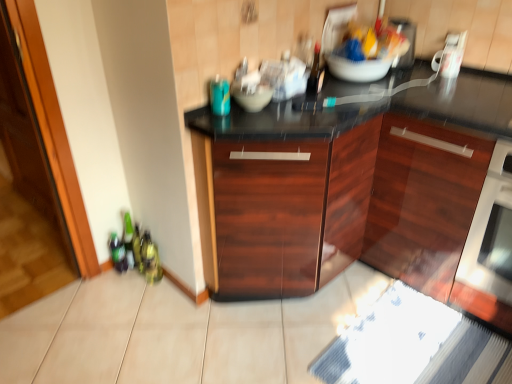
Question: Is satin white oven at right inside mahogany wood cabinet at center, the second cabinetry when ordered from right to left?

Choices:
 (A) no
 (B) yes

Answer: (A)

Question: Can you confirm if mahogany wood cabinet at center, the second cabinetry when ordered from right to left, is bigger than satin white oven at right?

Choices:
 (A) no
 (B) yes

Answer: (B)

Question: Does mahogany wood cabinet at center, the 1th cabinetry positioned from the left, have a lesser height compared to satin white oven at right?

Choices:
 (A) yes
 (B) no

Answer: (B)

Question: Is the position of mahogany wood cabinet at center, the second cabinetry when ordered from right to left, less distant than that of satin white oven at right?

Choices:
 (A) no
 (B) yes

Answer: (A)

Question: Does mahogany wood cabinet at center, the 1th cabinetry positioned from the left, come behind satin white oven at right?

Choices:
 (A) yes
 (B) no

Answer: (A)

Question: In terms of height, does dark wood cabinet at center, placed as the first cabinetry when sorted from right to left, look taller or shorter compared to transparent glass door at left?

Choices:
 (A) tall
 (B) short

Answer: (B)

Question: Looking at their shapes, would you say dark wood cabinet at center, acting as the 2th cabinetry starting from the left, is wider or thinner than transparent glass door at left?

Choices:
 (A) wide
 (B) thin

Answer: (A)

Question: Based on their sizes in the image, would you say dark wood cabinet at center, acting as the 2th cabinetry starting from the left, is bigger or smaller than transparent glass door at left?

Choices:
 (A) small
 (B) big

Answer: (B)

Question: Is point (415, 150) closer or farther from the camera than point (0, 193)?

Choices:
 (A) farther
 (B) closer

Answer: (B)

Question: In the image, is teal glass bottle at upper center positioned in front of or behind matte gray bowl at center?

Choices:
 (A) behind
 (B) front

Answer: (B)

Question: From the image's perspective, is teal glass bottle at upper center positioned above or below matte gray bowl at center?

Choices:
 (A) above
 (B) below

Answer: (B)

Question: Does point (214, 89) appear closer or farther from the camera than point (256, 99)?

Choices:
 (A) closer
 (B) farther

Answer: (A)

Question: Choose the correct answer: Is teal glass bottle at upper center inside matte gray bowl at center or outside it?

Choices:
 (A) outside
 (B) inside

Answer: (A)

Question: From the image's perspective, relative to white glossy toaster at upper right, is mahogany wood cabinet at center, the second cabinetry when ordered from right to left, above or below?

Choices:
 (A) below
 (B) above

Answer: (A)

Question: Does point (309, 162) appear closer or farther from the camera than point (441, 54)?

Choices:
 (A) farther
 (B) closer

Answer: (B)